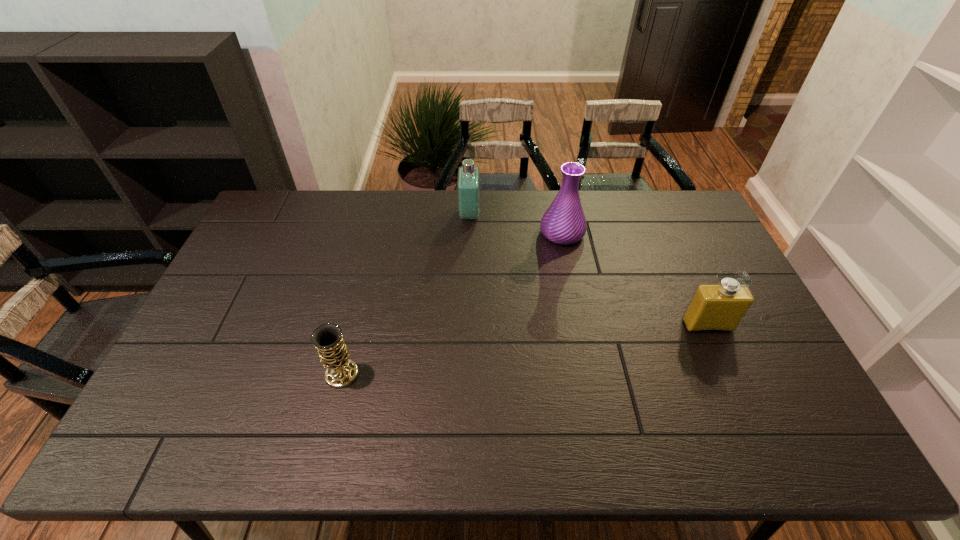
This screenshot has height=540, width=960. Find the location of `the tallest object`. the tallest object is located at coordinates (564, 222).

This screenshot has width=960, height=540. Find the location of `vase`. vase is located at coordinates (564, 222).

In order to click on the farther perfume in this screenshot , I will do `click(468, 183)`.

The image size is (960, 540). In order to click on the second object from left to right in this screenshot , I will do (468, 183).

At what (x,y) coordinates should I click in order to perform the action: click on the second nearest object. Please return your answer as a coordinate pair (x, y). The width and height of the screenshot is (960, 540). Looking at the image, I should click on (721, 307).

Locate an element on the screen. the nearer perfume is located at coordinates (721, 307).

At what (x,y) coordinates should I click in order to perform the action: click on the shortest object. Please return your answer as a coordinate pair (x, y). The width and height of the screenshot is (960, 540). Looking at the image, I should click on (328, 340).

Locate an element on the screen. The width and height of the screenshot is (960, 540). the leftmost object is located at coordinates (328, 340).

The height and width of the screenshot is (540, 960). Identify the location of vacant space located 0.390m on the right of the vase. (696, 233).

At what (x,y) coordinates should I click in order to perform the action: click on free location located on the front label of the farther perfume. Please return your answer as a coordinate pair (x, y). Looking at the image, I should click on (573, 214).